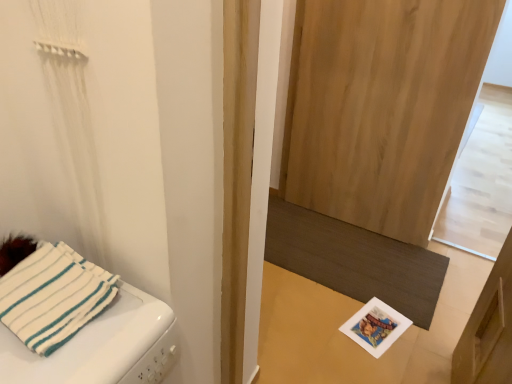
Question: From the image's perspective, is natural wood screen door at center located beneath dark brown textured mat at lower center?

Choices:
 (A) no
 (B) yes

Answer: (A)

Question: Can you confirm if natural wood screen door at center is taller than dark brown textured mat at lower center?

Choices:
 (A) yes
 (B) no

Answer: (A)

Question: Is natural wood screen door at center bigger than dark brown textured mat at lower center?

Choices:
 (A) no
 (B) yes

Answer: (B)

Question: From a real-world perspective, is natural wood screen door at center physically below dark brown textured mat at lower center?

Choices:
 (A) yes
 (B) no

Answer: (B)

Question: Is natural wood screen door at center behind dark brown textured mat at lower center?

Choices:
 (A) yes
 (B) no

Answer: (B)

Question: Is natural wood screen door at center to the left of dark brown textured mat at lower center from the viewer's perspective?

Choices:
 (A) no
 (B) yes

Answer: (A)

Question: Can you confirm if dark brown textured mat at lower center is smaller than white fabric towel at left?

Choices:
 (A) yes
 (B) no

Answer: (A)

Question: Is dark brown textured mat at lower center behind white fabric towel at left?

Choices:
 (A) yes
 (B) no

Answer: (A)

Question: Considering the relative sizes of dark brown textured mat at lower center and white fabric towel at left in the image provided, is dark brown textured mat at lower center shorter than white fabric towel at left?

Choices:
 (A) no
 (B) yes

Answer: (B)

Question: Is dark brown textured mat at lower center with white fabric towel at left?

Choices:
 (A) yes
 (B) no

Answer: (B)

Question: Is dark brown textured mat at lower center oriented away from white fabric towel at left?

Choices:
 (A) yes
 (B) no

Answer: (B)

Question: From the image's perspective, is dark brown textured mat at lower center on top of white fabric towel at left?

Choices:
 (A) no
 (B) yes

Answer: (B)

Question: Is dark brown textured mat at lower center oriented away from natural wood screen door at center?

Choices:
 (A) yes
 (B) no

Answer: (B)